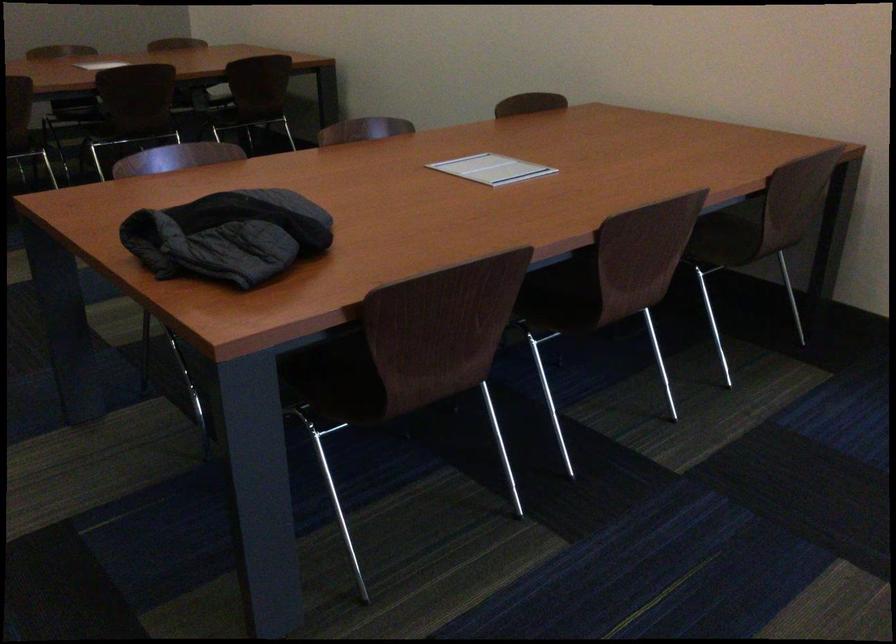
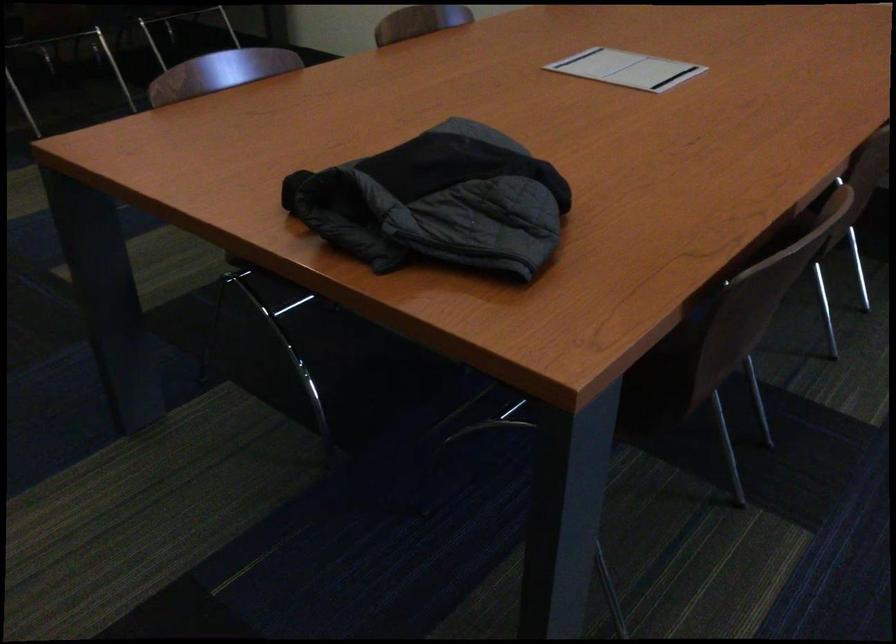
In the second image, find the point that corresponds to (x=412, y=402) in the first image.

(666, 386)